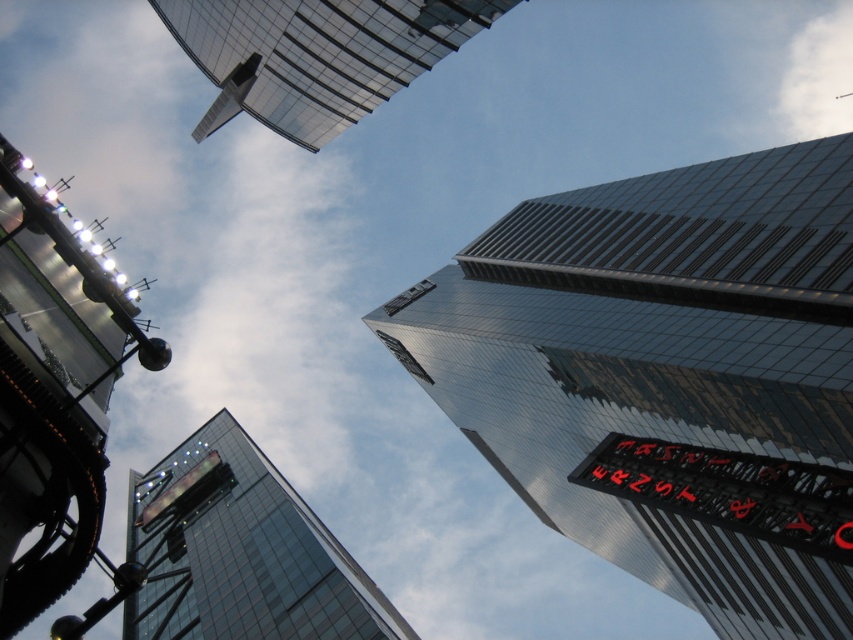
You are standing at the base of the transparent glass tower at upper center in the urban scene. Looking up, you notice another building feature. Which direction should you turn to see the other skyscrapers mentioned in the scene description?

Since the transparent glass tower at upper center is located at point (316, 54), turning to your right or left would allow you to see the other skyscrapers mentioned in the scene description depending on the layout. However, the exact direction isn

You are an architect evaluating the urban skyline. From your viewpoint, which of the two structures, the shiny glass skyscraper at upper right or the metallic glass tower at upper left, appears larger in size?

The shiny glass skyscraper at upper right appears larger in size than the metallic glass tower at upper left.

You are an architect evaluating the urban skyline. From your vantage point, which object would appear larger in the image, the transparent glass tower at upper center or the red led sign at right?

The transparent glass tower at upper center is taller than the red led sign at right, so it would appear larger in the image.